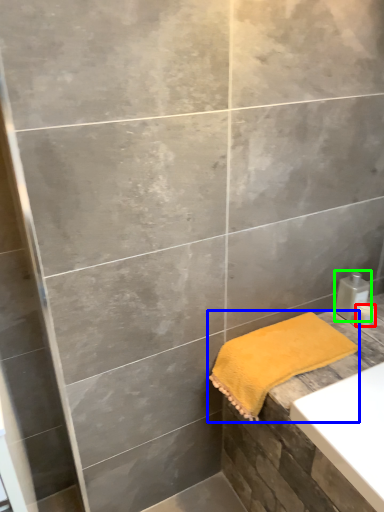
Question: Estimate the real-world distances between objects in this image. Which object is farther from toiletry (highlighted by a red box), towel (highlighted by a blue box) or soap dispenser (highlighted by a green box)?

Choices:
 (A) towel
 (B) soap dispenser

Answer: (A)